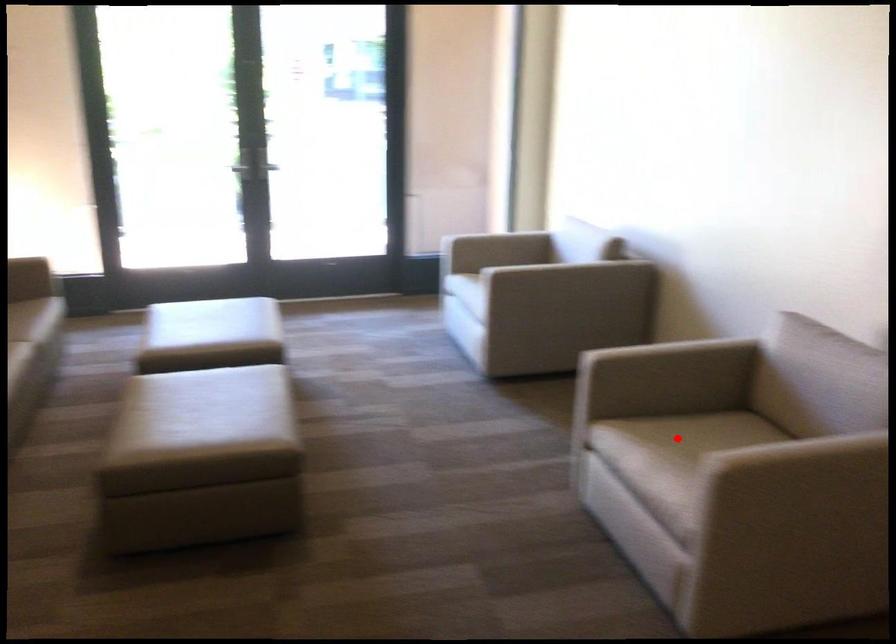
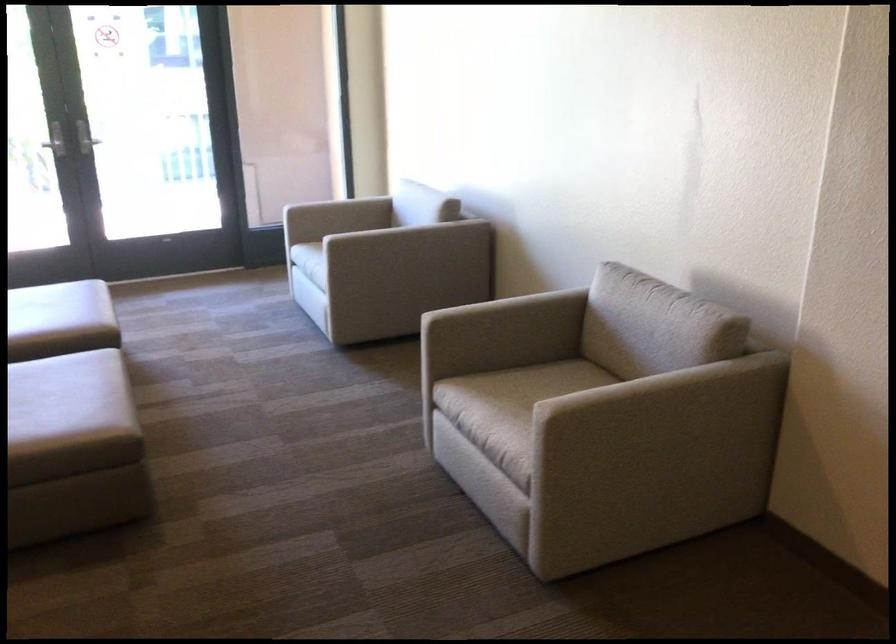
In the second image, find the point that corresponds to the highlighted location in the first image.

(513, 389)